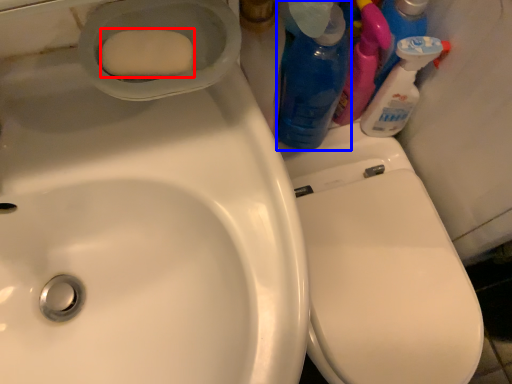
Question: Which point is further to the camera, soap (highlighted by a red box) or cleaning product (highlighted by a blue box)?

Choices:
 (A) soap
 (B) cleaning product

Answer: (B)